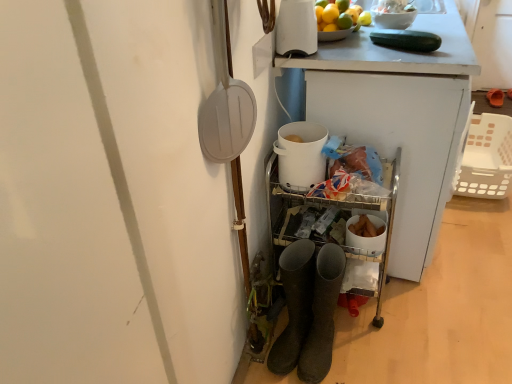
This screenshot has width=512, height=384. I want to click on white glossy kettle at upper center, which ranks as the second appliance in bottom-to-top order, so click(x=296, y=28).

The height and width of the screenshot is (384, 512). Describe the element at coordinates (495, 97) in the screenshot. I see `orange rubber boots at lower right, the second footwear positioned from the front` at that location.

This screenshot has width=512, height=384. I want to click on white plastic shovel at upper left, so click(x=225, y=101).

This screenshot has width=512, height=384. Describe the element at coordinates (225, 101) in the screenshot. I see `white plastic shovel at upper left` at that location.

Where is `white matte bucket at center, which is the 2th appliance from top to bottom`? The width and height of the screenshot is (512, 384). white matte bucket at center, which is the 2th appliance from top to bottom is located at coordinates (301, 155).

What do you see at coordinates (322, 315) in the screenshot?
I see `dark brown suede boots at lower center, which is the second footwear in back-to-front order` at bounding box center [322, 315].

Where is `white glossy kettle at upper center, marked as the 1th appliance in a top-to-bottom arrangement`? The image size is (512, 384). white glossy kettle at upper center, marked as the 1th appliance in a top-to-bottom arrangement is located at coordinates (296, 28).

Could you tell me if dark brown suede boots at lower center, which appears as the 2th footwear when viewed from the right, is facing white plastic shovel at upper left?

No, dark brown suede boots at lower center, which appears as the 2th footwear when viewed from the right, does not turn towards white plastic shovel at upper left.

Are dark brown suede boots at lower center, which is the second footwear in back-to-front order, and white plastic shovel at upper left making contact?

No, dark brown suede boots at lower center, which is the second footwear in back-to-front order, is not beside white plastic shovel at upper left.

From the image's perspective, is dark brown suede boots at lower center, arranged as the first footwear when viewed from the front, over white plastic shovel at upper left?

Actually, dark brown suede boots at lower center, arranged as the first footwear when viewed from the front, appears below white plastic shovel at upper left in the image.

From a real-world perspective, is dark brown suede boots at lower center, positioned as the second footwear in top-to-bottom order, physically located above or below white plastic shovel at upper left?

dark brown suede boots at lower center, positioned as the second footwear in top-to-bottom order, is below white plastic shovel at upper left.

Considering the relative sizes of white plastic shovel at upper left and orange rubber boots at lower right, the second footwear positioned from the front, in the image provided, is white plastic shovel at upper left thinner than orange rubber boots at lower right, the second footwear positioned from the front,?

Yes.

From the image's perspective, between white plastic shovel at upper left and orange rubber boots at lower right, acting as the 1th footwear starting from the back, which one is located above?

orange rubber boots at lower right, acting as the 1th footwear starting from the back, appears higher in the image.

Does white plastic shovel at upper left appear on the left side of orange rubber boots at lower right, placed as the second footwear when sorted from bottom to top?

Correct, you'll find white plastic shovel at upper left to the left of orange rubber boots at lower right, placed as the second footwear when sorted from bottom to top.

Is white matte bucket at center, which is the 2th appliance from top to bottom, in contact with orange rubber boots at lower right, placed as the second footwear when sorted from bottom to top?

No, white matte bucket at center, which is the 2th appliance from top to bottom, is not beside orange rubber boots at lower right, placed as the second footwear when sorted from bottom to top.

From the picture: From a real-world perspective, which object rests below the other?

orange rubber boots at lower right, positioned as the first footwear in top-to-bottom order, is physically lower.

There is a orange rubber boots at lower right, which is the first footwear in right-to-left order. Identify the location of the 2nd appliance below it (from the image's perspective). (301, 155).

Is white matte bucket at center, the 1th appliance ordered from the bottom, facing towards orange rubber boots at lower right, acting as the 1th footwear starting from the back?

No, white matte bucket at center, the 1th appliance ordered from the bottom, does not turn towards orange rubber boots at lower right, acting as the 1th footwear starting from the back.

Is white plastic basket at right turned away from white glossy bowl at upper right?

No, white glossy bowl at upper right is not at the back of white plastic basket at right.

Is white plastic basket at right thinner than white glossy bowl at upper right?

In fact, white plastic basket at right might be wider than white glossy bowl at upper right.

From a real-world perspective, who is located lower, white plastic basket at right or white glossy bowl at upper right?

white plastic basket at right is physically lower.

From the image's perspective, is white plastic basket at right beneath white glossy bowl at upper right?

Yes.

Considering the positions of objects white glossy bowl at upper right and orange rubber boots at lower right, placed as the second footwear when sorted from bottom to top, in the image provided, who is more to the left, white glossy bowl at upper right or orange rubber boots at lower right, placed as the second footwear when sorted from bottom to top,?

Positioned to the left is white glossy bowl at upper right.

From a real-world perspective, who is located higher, white glossy bowl at upper right or orange rubber boots at lower right, arranged as the 2th footwear when viewed from the left?

In real-world perspective, white glossy bowl at upper right is above.

From the picture: How many degrees apart are the facing directions of white glossy bowl at upper right and orange rubber boots at lower right, which is the first footwear in right-to-left order?

There is a 90.9-degree angle between the facing directions of white glossy bowl at upper right and orange rubber boots at lower right, which is the first footwear in right-to-left order.

Is the position of white glossy bowl at upper right less distant than that of orange rubber boots at lower right, arranged as the 2th footwear when viewed from the left?

That is True.

Where is `bowl above the dark brown suede boots at lower center, which appears as the 2th footwear when viewed from the right (from the image's perspective)`? This screenshot has height=384, width=512. bowl above the dark brown suede boots at lower center, which appears as the 2th footwear when viewed from the right (from the image's perspective) is located at coordinates (393, 19).

Is point (373, 10) farther from camera compared to point (319, 363)?

That is True.

From a real-world perspective, which is physically below, white glossy bowl at upper right or dark brown suede boots at lower center, arranged as the first footwear when viewed from the front?

dark brown suede boots at lower center, arranged as the first footwear when viewed from the front, is physically lower.

Would you say white glossy bowl at upper right is a long distance from dark brown suede boots at lower center, arranged as the first footwear when viewed from the front?

That's not correct — white glossy bowl at upper right is a little close to dark brown suede boots at lower center, arranged as the first footwear when viewed from the front.

From a real-world perspective, count 2nd appliances upward from the orange rubber boots at lower right, arranged as the 2th footwear when viewed from the left, and point to it. Please provide its 2D coordinates.

[(296, 28)]

Can you confirm if white glossy kettle at upper center, which ranks as the second appliance in bottom-to-top order, is bigger than orange rubber boots at lower right, arranged as the 2th footwear when viewed from the left?

Yes, white glossy kettle at upper center, which ranks as the second appliance in bottom-to-top order, is bigger than orange rubber boots at lower right, arranged as the 2th footwear when viewed from the left.

Is white glossy kettle at upper center, which ranks as the second appliance in bottom-to-top order, completely or partially outside of orange rubber boots at lower right, placed as the second footwear when sorted from bottom to top?

Absolutely, white glossy kettle at upper center, which ranks as the second appliance in bottom-to-top order, is external to orange rubber boots at lower right, placed as the second footwear when sorted from bottom to top.

Is orange rubber boots at lower right, positioned as the first footwear in top-to-bottom order, at the back of white glossy kettle at upper center, which ranks as the second appliance in bottom-to-top order?

No.

Find the location of a particular element. shovel above the dark brown suede boots at lower center, which ranks as the 1th footwear in bottom-to-top order (from the image's perspective) is located at coordinates (225, 101).

Where is `shovel on the left of the orange rubber boots at lower right, arranged as the 2th footwear when viewed from the left`? shovel on the left of the orange rubber boots at lower right, arranged as the 2th footwear when viewed from the left is located at coordinates point(225,101).

From the image, which object appears to be farther from white plastic basket at right, white plastic shovel at upper left or white glossy kettle at upper center, marked as the 1th appliance in a top-to-bottom arrangement?

white plastic shovel at upper left.

When comparing their distances from white plastic basket at right, does white plastic shovel at upper left or orange rubber boots at lower right, which is the first footwear in right-to-left order, seem further?

Among the two, white plastic shovel at upper left is located further to white plastic basket at right.

Estimate the real-world distances between objects in this image. Which object is closer to orange rubber boots at lower right, acting as the 1th footwear starting from the back, white plastic basket at right or dark brown suede boots at lower center, positioned as the second footwear in top-to-bottom order?

Among the two, white plastic basket at right is located nearer to orange rubber boots at lower right, acting as the 1th footwear starting from the back.

Based on their spatial positions, is white glossy kettle at upper center, which ranks as the second appliance in bottom-to-top order, or white matte bucket at center, which is the 2th appliance from top to bottom, closer to green matte cucumber at upper right?

white glossy kettle at upper center, which ranks as the second appliance in bottom-to-top order, is positioned closer to the anchor green matte cucumber at upper right.

Looking at the image, which one is located further to orange rubber boots at lower right, acting as the 1th footwear starting from the back, white matte bucket at center, the 1th appliance ordered from the bottom, or dark brown suede boots at lower center, which is counted as the 1th footwear, starting from the left?

dark brown suede boots at lower center, which is counted as the 1th footwear, starting from the left.

Considering their positions, is green matte cucumber at upper right positioned closer to white glossy kettle at upper center, which ranks as the second appliance in bottom-to-top order, than orange rubber boots at lower right, acting as the 1th footwear starting from the back?

green matte cucumber at upper right is closer to white glossy kettle at upper center, which ranks as the second appliance in bottom-to-top order.

Which object lies nearer to the anchor point white plastic shovel at upper left, green matte cucumber at upper right or white matte bucket at center, which is the 2th appliance from top to bottom?

white matte bucket at center, which is the 2th appliance from top to bottom, lies closer to white plastic shovel at upper left than the other object.

Looking at the image, which one is located closer to white plastic basket at right, dark brown suede boots at lower center, arranged as the first footwear when viewed from the front, or white plastic shovel at upper left?

dark brown suede boots at lower center, arranged as the first footwear when viewed from the front, is positioned closer to the anchor white plastic basket at right.

Where is `basket between white glossy kettle at upper center, marked as the 1th appliance in a top-to-bottom arrangement, and orange rubber boots at lower right, which is the first footwear in right-to-left order, along the z-axis`? basket between white glossy kettle at upper center, marked as the 1th appliance in a top-to-bottom arrangement, and orange rubber boots at lower right, which is the first footwear in right-to-left order, along the z-axis is located at coordinates (487, 158).

Locate an element on the screen. bowl between white plastic shovel at upper left and orange rubber boots at lower right, positioned as the first footwear in top-to-bottom order, in the front-back direction is located at coordinates (393, 19).

You are a GUI agent. You are given a task and a screenshot of the screen. Output one action in this format:
    pyautogui.click(x=<x>, y=<y>)
    Task: Click on the appliance that lies between white glossy kettle at upper center, marked as the 1th appliance in a top-to-bottom arrangement, and dark brown suede boots at lower center, positioned as the second footwear in top-to-bottom order, from top to bottom
    This screenshot has width=512, height=384.
    Given the screenshot: What is the action you would take?
    pyautogui.click(x=301, y=155)

The image size is (512, 384). Identify the location of cucumber that lies between white glossy kettle at upper center, which ranks as the second appliance in bottom-to-top order, and white matte bucket at center, which is the 2th appliance from top to bottom, from top to bottom. (406, 40).